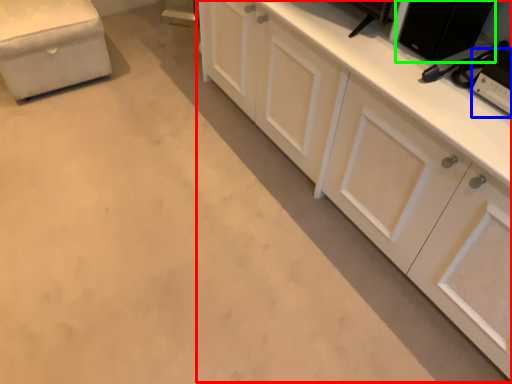
Question: Considering the real-world distances, which object is farthest from cabinetry (highlighted by a red box)? appliance (highlighted by a blue box) or appliance (highlighted by a green box)?

Choices:
 (A) appliance
 (B) appliance

Answer: (A)